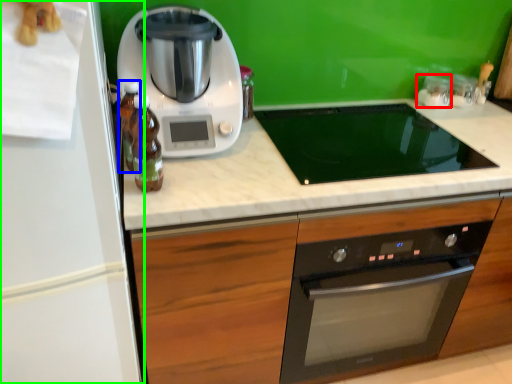
Question: Considering the real-world distances, which object is closest to appliance (highlighted by a red box)? bottle (highlighted by a blue box) or refrigerator (highlighted by a green box).

Choices:
 (A) bottle
 (B) refrigerator

Answer: (A)